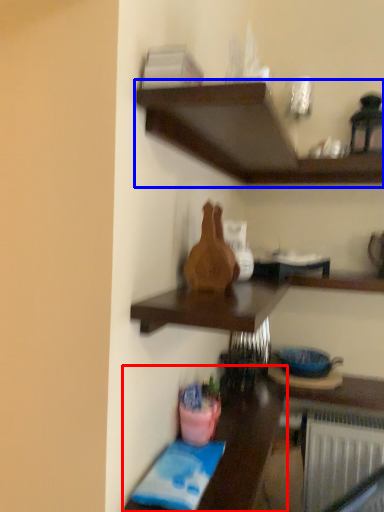
Question: Which point is closer to the camera, table (highlighted by a red box) or shelf (highlighted by a blue box)?

Choices:
 (A) table
 (B) shelf

Answer: (B)